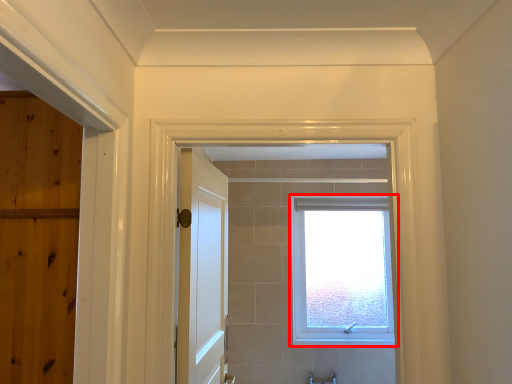
Question: From the image's perspective, where is window (annotated by the red box) located relative to door?

Choices:
 (A) above
 (B) below

Answer: (B)